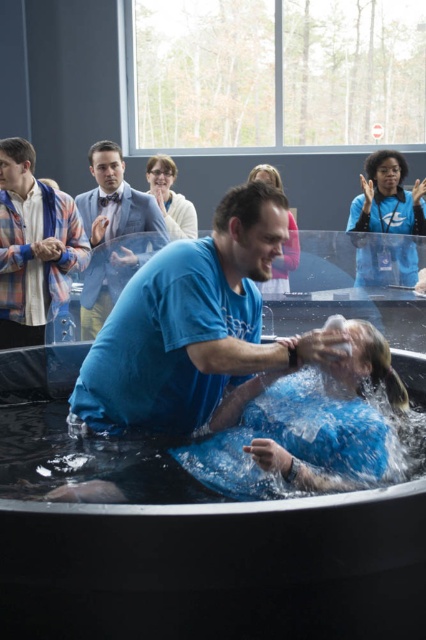
Question: Which object is the closest to the blue fabric suit at center?

Choices:
 (A) plaid shirt at left
 (B) blue smooth shirt at center

Answer: (A)

Question: Which point appears closest to the camera in this image?

Choices:
 (A) (155, 195)
 (B) (259, 628)
 (C) (71, 208)
 (D) (359, 205)

Answer: (B)

Question: Is blue fabric suit at center closer to camera compared to matte white sweater at upper center?

Choices:
 (A) no
 (B) yes

Answer: (B)

Question: Can you confirm if blue fabric suit at center is wider than matte white sweater at upper center?

Choices:
 (A) yes
 (B) no

Answer: (A)

Question: Can you confirm if black rubber tub at center is positioned below blue matte shirt at center?

Choices:
 (A) no
 (B) yes

Answer: (A)

Question: Which of the following is the closest to the observer?

Choices:
 (A) (155, 170)
 (B) (23, 292)

Answer: (B)